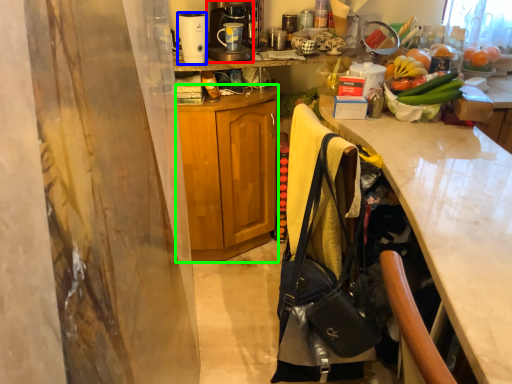
Question: Estimate the real-world distances between objects in this image. Which object is farther from coffee maker (highlighted by a red box), kitchen appliance (highlighted by a blue box) or cabinetry (highlighted by a green box)?

Choices:
 (A) kitchen appliance
 (B) cabinetry

Answer: (B)